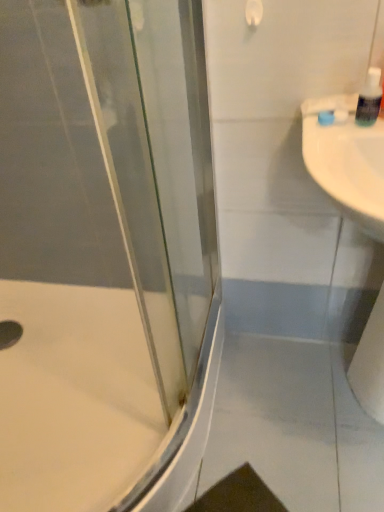
Question: Is white glossy sink at right wider than white glossy bath at lower left?

Choices:
 (A) yes
 (B) no

Answer: (B)

Question: From the image's perspective, is white glossy sink at right beneath white glossy bath at lower left?

Choices:
 (A) no
 (B) yes

Answer: (A)

Question: Is white glossy sink at right in contact with white glossy bath at lower left?

Choices:
 (A) yes
 (B) no

Answer: (B)

Question: Considering the relative positions of white glossy sink at right and white glossy bath at lower left in the image provided, is white glossy sink at right to the left of white glossy bath at lower left from the viewer's perspective?

Choices:
 (A) yes
 (B) no

Answer: (B)

Question: Considering the relative sizes of white glossy sink at right and white glossy bath at lower left in the image provided, is white glossy sink at right smaller than white glossy bath at lower left?

Choices:
 (A) no
 (B) yes

Answer: (B)

Question: Could white glossy bath at lower left be considered to be inside white glossy sink at right?

Choices:
 (A) yes
 (B) no

Answer: (B)

Question: From a real-world perspective, is transparent glass shower door at left on clear plastic soap dispenser at upper right?

Choices:
 (A) yes
 (B) no

Answer: (B)

Question: Is transparent glass shower door at left smaller than clear plastic soap dispenser at upper right?

Choices:
 (A) no
 (B) yes

Answer: (A)

Question: Can you confirm if transparent glass shower door at left is shorter than clear plastic soap dispenser at upper right?

Choices:
 (A) yes
 (B) no

Answer: (B)

Question: Is transparent glass shower door at left taller than clear plastic soap dispenser at upper right?

Choices:
 (A) yes
 (B) no

Answer: (A)

Question: Considering the relative sizes of transparent glass shower door at left and clear plastic soap dispenser at upper right in the image provided, is transparent glass shower door at left bigger than clear plastic soap dispenser at upper right?

Choices:
 (A) yes
 (B) no

Answer: (A)

Question: Is transparent glass shower door at left oriented away from clear plastic soap dispenser at upper right?

Choices:
 (A) yes
 (B) no

Answer: (B)

Question: Can you confirm if white glossy sink at right is taller than white matte toilet paper at right?

Choices:
 (A) no
 (B) yes

Answer: (A)